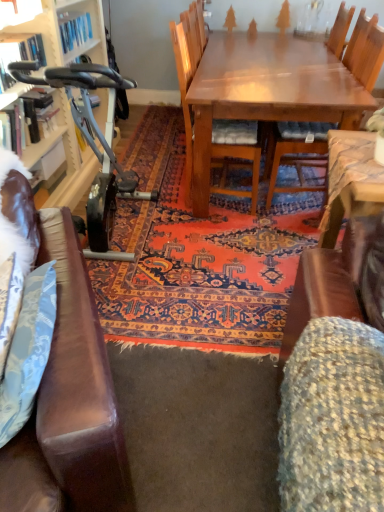
This screenshot has width=384, height=512. I want to click on blank area beneath metallic blue exercise bike at left (from a real-world perspective), so click(x=127, y=233).